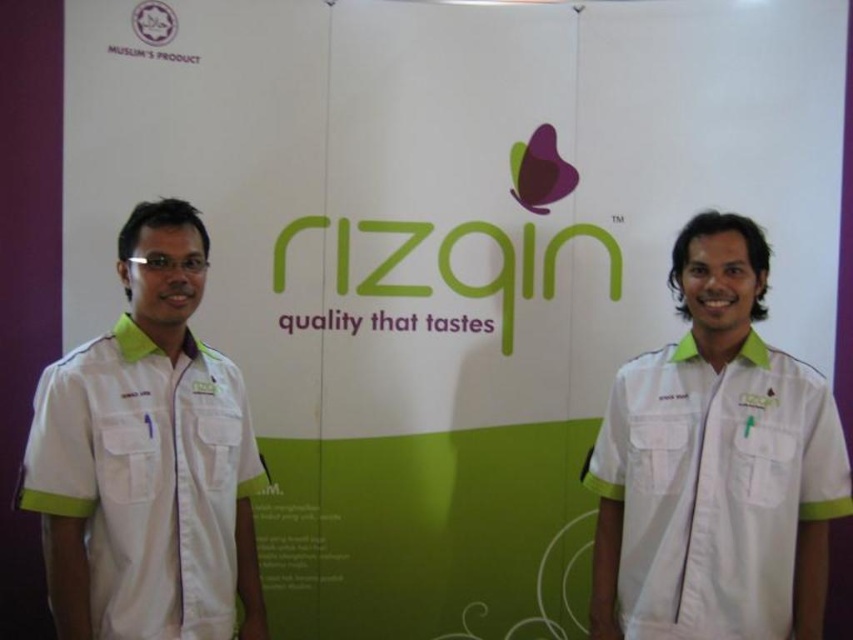
In the scene shown: Can you confirm if white fabric shirt at center is positioned above matte plastic logo at upper left?

No.

From the picture: Who is taller, white fabric shirt at center or matte plastic logo at upper left?

With more height is white fabric shirt at center.

Between point (662, 570) and point (144, 42), which one is positioned in front?

Point (662, 570) is more forward.

I want to click on white fabric shirt at center, so click(x=717, y=464).

Is point (97, 499) positioned after point (169, 8)?

That is False.

Find the location of a particular element. The image size is (853, 640). white fabric shirt at left is located at coordinates point(148,458).

Who is positioned more to the left, white fabric shirt at center or white fabric shirt at left?

white fabric shirt at left is more to the left.

Is white fabric shirt at center wider than white fabric shirt at left?

Yes, white fabric shirt at center is wider than white fabric shirt at left.

Which is in front, point (839, 440) or point (180, 332)?

Point (839, 440)

In order to click on white fabric shirt at center in this screenshot , I will do `click(717, 464)`.